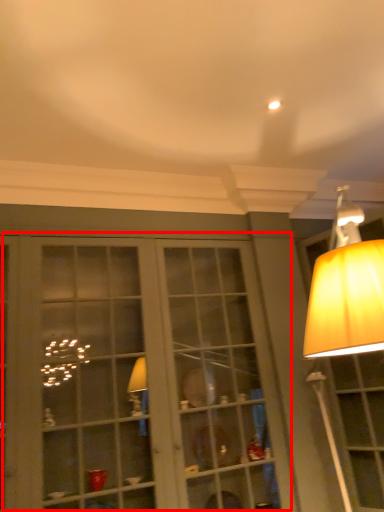
Question: From the image's perspective, where is bay window (annotated by the red box) located relative to lamp?

Choices:
 (A) above
 (B) below

Answer: (B)